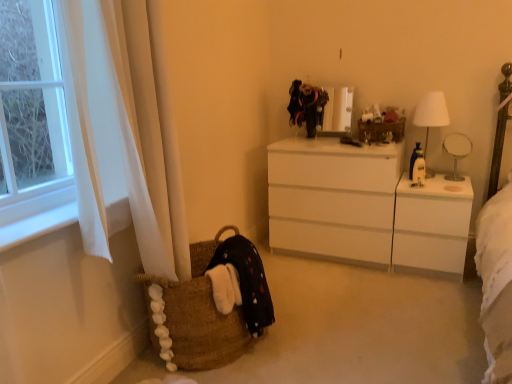
Question: Is velvet black dress at upper center, acting as the 2th clothing starting from the left, in contact with white fabric lampshade at right?

Choices:
 (A) no
 (B) yes

Answer: (A)

Question: Considering the relative sizes of velvet black dress at upper center, which ranks as the second clothing in front-to-back order, and white fabric lampshade at right in the image provided, is velvet black dress at upper center, which ranks as the second clothing in front-to-back order, bigger than white fabric lampshade at right?

Choices:
 (A) no
 (B) yes

Answer: (A)

Question: Is velvet black dress at upper center, which is the 1th clothing in back-to-front order, positioned in front of white fabric lampshade at right?

Choices:
 (A) yes
 (B) no

Answer: (B)

Question: From a real-world perspective, is velvet black dress at upper center, the first clothing viewed from the right, under white fabric lampshade at right?

Choices:
 (A) no
 (B) yes

Answer: (A)

Question: Is velvet black dress at upper center, the second clothing ordered from the bottom, smaller than white fabric lampshade at right?

Choices:
 (A) yes
 (B) no

Answer: (A)

Question: From their relative heights in the image, would you say black cotton dress at lower left, which is the second clothing in right-to-left order, is taller or shorter than white glossy table lamp at right?

Choices:
 (A) tall
 (B) short

Answer: (A)

Question: In terms of width, does black cotton dress at lower left, which is the 1th clothing in front-to-back order, look wider or thinner when compared to white glossy table lamp at right?

Choices:
 (A) thin
 (B) wide

Answer: (B)

Question: From a real-world perspective, is black cotton dress at lower left, which is the 1th clothing in front-to-back order, physically located above or below white glossy table lamp at right?

Choices:
 (A) below
 (B) above

Answer: (A)

Question: From the image's perspective, is black cotton dress at lower left, which is the second clothing in right-to-left order, located above or below white glossy table lamp at right?

Choices:
 (A) below
 (B) above

Answer: (A)

Question: In terms of height, does black cotton dress at lower left, which ranks as the first clothing in bottom-to-top order, look taller or shorter compared to white fabric lampshade at right?

Choices:
 (A) short
 (B) tall

Answer: (A)

Question: From a real-world perspective, is black cotton dress at lower left, which appears as the second clothing when viewed from the back, above or below white fabric lampshade at right?

Choices:
 (A) above
 (B) below

Answer: (B)

Question: From the image's perspective, is black cotton dress at lower left, the first clothing when ordered from left to right, positioned above or below white fabric lampshade at right?

Choices:
 (A) below
 (B) above

Answer: (A)

Question: Choose the correct answer: Is black cotton dress at lower left, which is the 1th clothing in front-to-back order, inside white fabric lampshade at right or outside it?

Choices:
 (A) outside
 (B) inside

Answer: (A)

Question: From a real-world perspective, is brown woven basket at lower left physically located above or below white glossy changing table at right?

Choices:
 (A) above
 (B) below

Answer: (B)

Question: Is point (199, 337) closer or farther from the camera than point (462, 201)?

Choices:
 (A) closer
 (B) farther

Answer: (A)